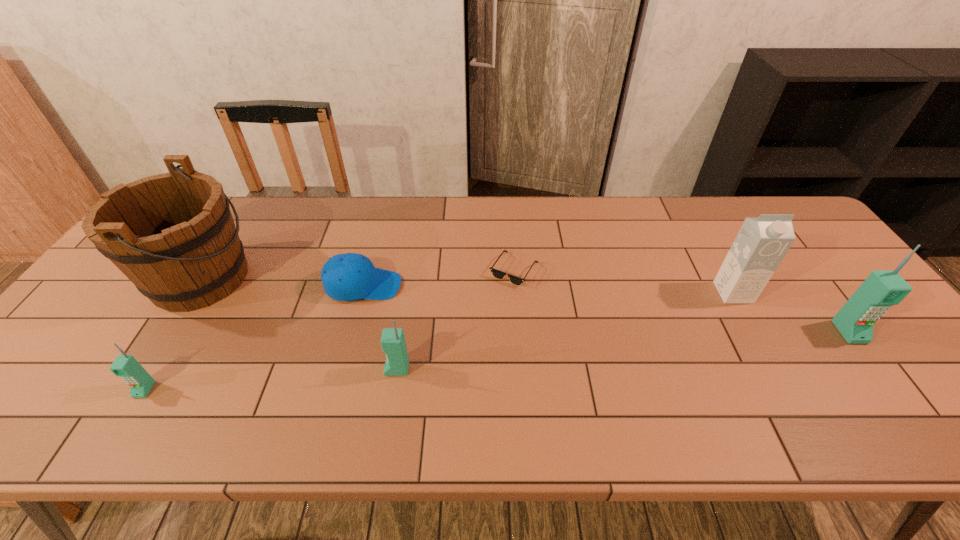
At what (x,y) coordinates should I click in order to perform the action: click on object at the left edge. Please return your answer as a coordinate pair (x, y). Image resolution: width=960 pixels, height=540 pixels. Looking at the image, I should click on (172, 235).

Where is `object located in the right edge section of the desktop`? The image size is (960, 540). object located in the right edge section of the desktop is located at coordinates pos(855,320).

The height and width of the screenshot is (540, 960). Find the location of `object that is at the far left corner`. object that is at the far left corner is located at coordinates (172, 235).

Where is `vacant space at the far edge of the desktop`? vacant space at the far edge of the desktop is located at coordinates (684, 205).

The height and width of the screenshot is (540, 960). What are the coordinates of `vacant space at the near edge` in the screenshot? It's located at (280, 382).

Find the location of a particular element. vacant space at the left edge of the desktop is located at coordinates (69, 330).

Where is `vacant space at the right edge`? vacant space at the right edge is located at coordinates (901, 361).

Find the location of a particular element. vacant space at the near left corner of the desktop is located at coordinates (52, 375).

Identify the location of vacant space at the near right corner of the desktop. (875, 365).

At what (x,y) coordinates should I click in order to perform the action: click on unoccupied area between the carton and the wine bucket. Please return your answer as a coordinate pair (x, y). This screenshot has height=540, width=960. Looking at the image, I should click on (467, 285).